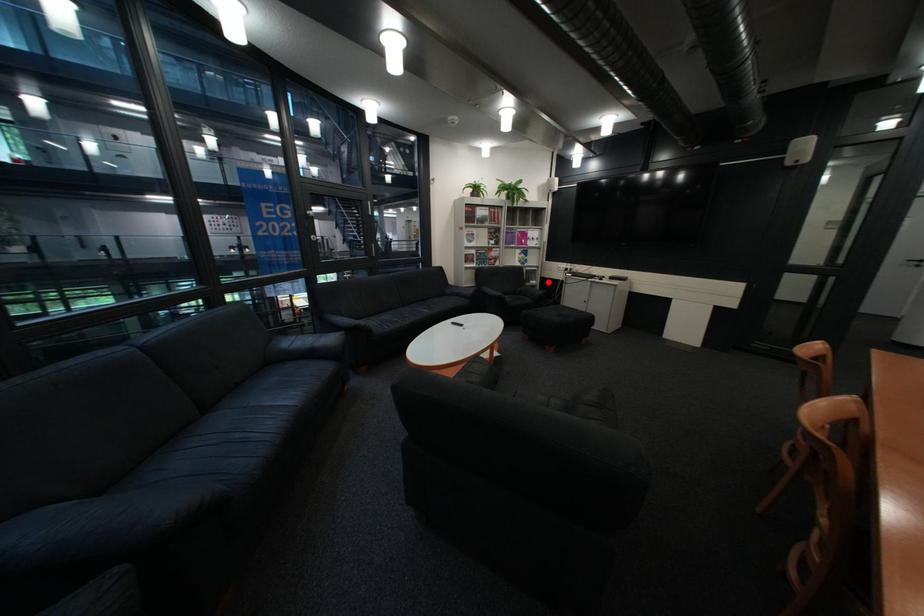
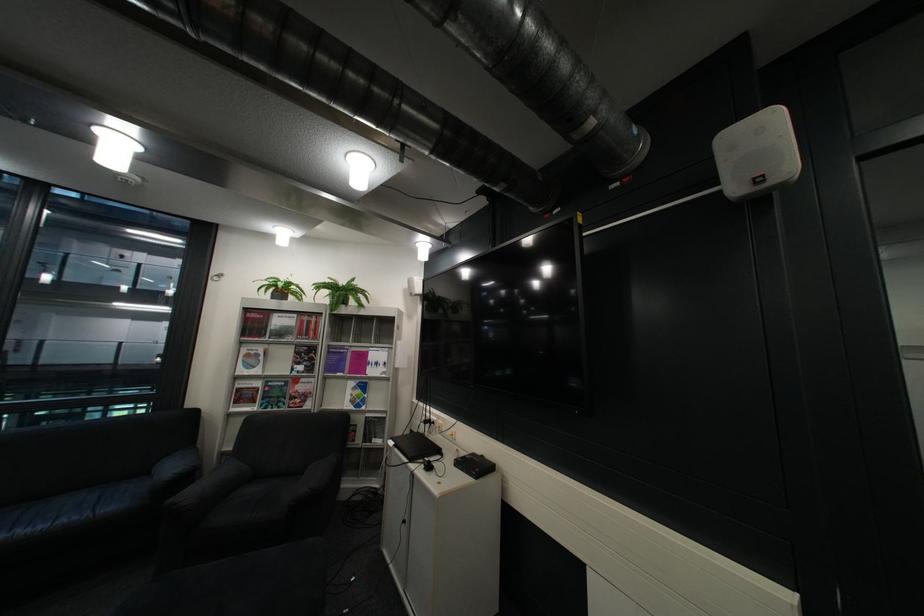
The point at the highlighted location is marked in the first image. Where is the corresponding point in the second image?

(393, 442)